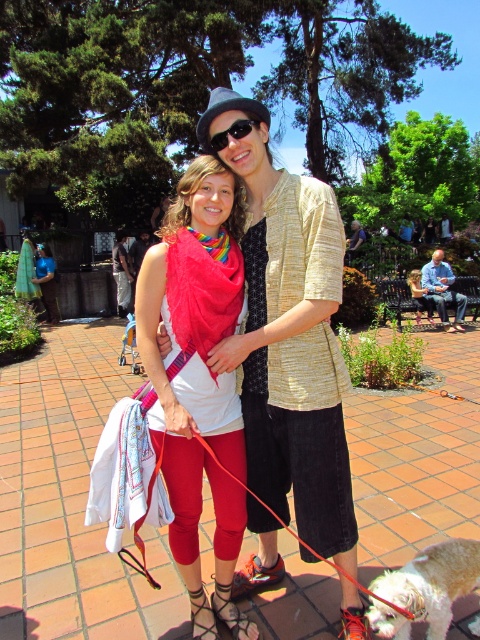
Can you confirm if matte red scarf at center is positioned above blue denim shirt at center?

Incorrect, matte red scarf at center is not positioned above blue denim shirt at center.

Which is more to the left, matte red scarf at center or blue denim shirt at center?

matte red scarf at center

Does point (239, 637) lie in front of point (457, 298)?

Yes, point (239, 637) is closer to viewer.

Find the location of `matte red scarf at center`. matte red scarf at center is located at coordinates (199, 380).

Is matte red scarf at center in front of black plastic sunglasses at upper center?

Yes, matte red scarf at center is in front of black plastic sunglasses at upper center.

Which is in front, point (169, 470) or point (228, 134)?

Positioned in front is point (228, 134).

You are a GUI agent. You are given a task and a screenshot of the screen. Output one action in this format:
    pyautogui.click(x=<x>, y=<y>)
    Task: Click on the matte red scarf at center
    Image resolution: width=480 pixels, height=640 pixels.
    Given the screenshot: What is the action you would take?
    pyautogui.click(x=199, y=380)

Which of these two, matte black hat at upper center or white fluffy dog at lower right, stands taller?

Standing taller between the two is matte black hat at upper center.

From the picture: Who is positioned more to the left, matte black hat at upper center or white fluffy dog at lower right?

Positioned to the left is matte black hat at upper center.

Is point (333, 538) closer to camera compared to point (437, 612)?

No, it is behind (437, 612).

Where is `matte black hat at upper center`? This screenshot has width=480, height=640. matte black hat at upper center is located at coordinates (288, 337).